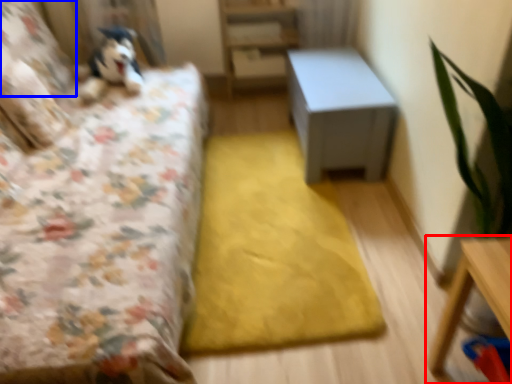
Question: Which object appears closest to the camera in this image, table (highlighted by a red box) or pillow (highlighted by a blue box)?

Choices:
 (A) table
 (B) pillow

Answer: (A)